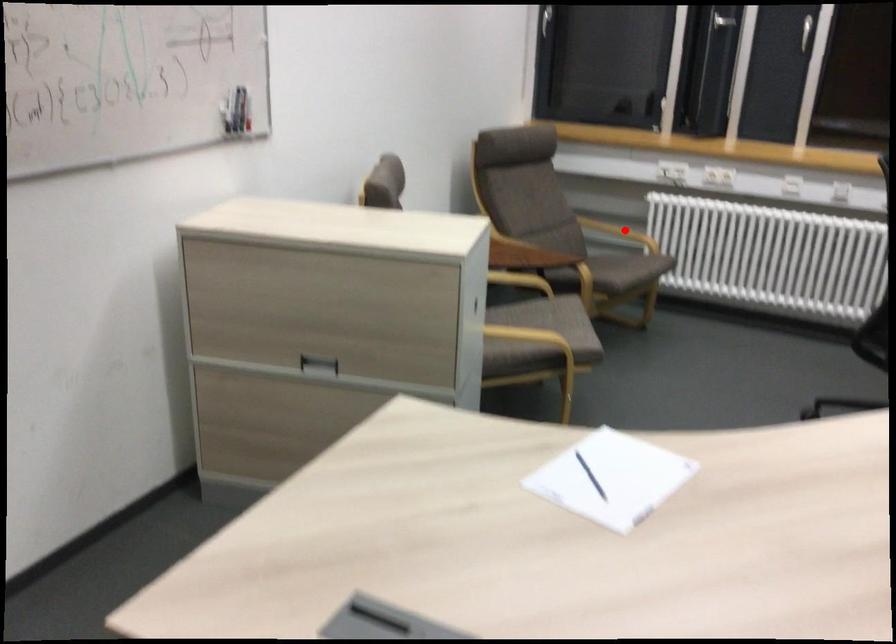
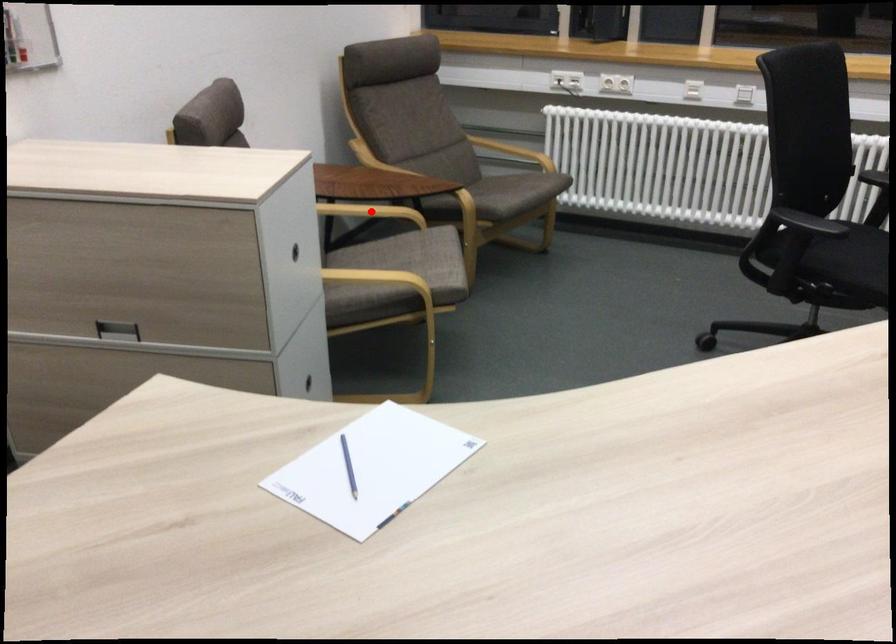
I am providing you with two images of the same scene from different viewpoints. A red point is marked on the first image and another point is marked on the second image. Do the highlighted points in image1 and image2 indicate the same real-world spot?

No